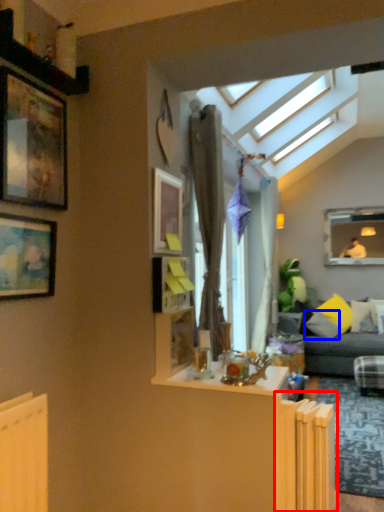
Question: Among these objects, which one is nearest to the camera, radiator (highlighted by a red box) or pillow (highlighted by a blue box)?

Choices:
 (A) radiator
 (B) pillow

Answer: (A)